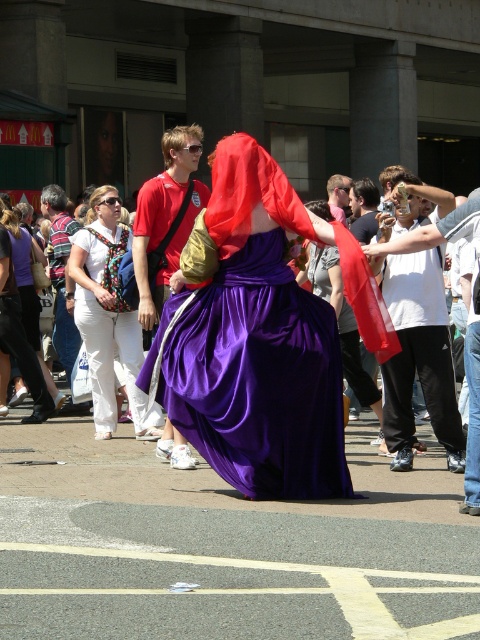
You are a photographer trying to capture the vibrant purple gown figure in the center. You notice two people wearing matte white pants at center and matte white pants at lower left. Which person wearing matte white pants is closer to the right side of the frame?

The matte white pants at center is positioned on the right side of matte white pants at lower left, so the person wearing matte white pants at center is closer to the right side of the frame.

You are standing in the crowd at the lively street scene and want to take a photo of both the central figure in the purple gown and the person with the red shirt. The central figure is at point (x=440, y=356) and the person with the red shirt is at point (x=95, y=314). Which of these two points is closer to you so that you can focus your camera properly?

Point (x=440, y=356) is closer to the camera than point (x=95, y=314), so you should focus on that point first to capture the central figure clearly.